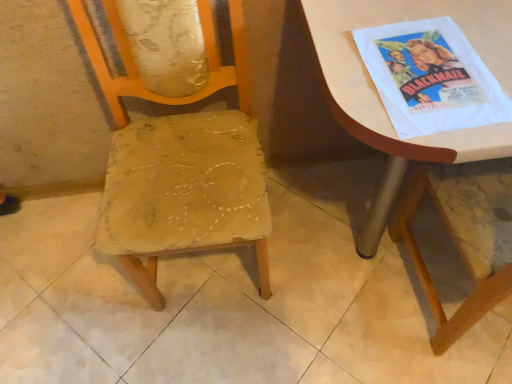
Question: Considering the relative sizes of white paper poster at upper right and worn fabric chair at center in the image provided, is white paper poster at upper right bigger than worn fabric chair at center?

Choices:
 (A) yes
 (B) no

Answer: (B)

Question: Is white paper poster at upper right to the right of worn fabric chair at center from the viewer's perspective?

Choices:
 (A) no
 (B) yes

Answer: (B)

Question: Is worn fabric chair at center a part of white paper poster at upper right?

Choices:
 (A) yes
 (B) no

Answer: (B)

Question: Considering the relative sizes of white paper poster at upper right and worn fabric chair at center in the image provided, is white paper poster at upper right wider than worn fabric chair at center?

Choices:
 (A) yes
 (B) no

Answer: (B)

Question: Is the position of white paper poster at upper right less distant than that of worn fabric chair at center?

Choices:
 (A) yes
 (B) no

Answer: (B)

Question: Is white paper poster at upper right shorter than worn fabric chair at center?

Choices:
 (A) no
 (B) yes

Answer: (B)

Question: Considering the relative sizes of white glossy table at upper right and worn fabric chair at center in the image provided, is white glossy table at upper right bigger than worn fabric chair at center?

Choices:
 (A) no
 (B) yes

Answer: (B)

Question: Is white glossy table at upper right positioned beyond the bounds of worn fabric chair at center?

Choices:
 (A) yes
 (B) no

Answer: (A)

Question: From a real-world perspective, is white glossy table at upper right below worn fabric chair at center?

Choices:
 (A) yes
 (B) no

Answer: (A)

Question: Can you confirm if white glossy table at upper right is smaller than worn fabric chair at center?

Choices:
 (A) no
 (B) yes

Answer: (A)

Question: Can you confirm if white glossy table at upper right is shorter than worn fabric chair at center?

Choices:
 (A) no
 (B) yes

Answer: (B)

Question: Are white glossy table at upper right and worn fabric chair at center making contact?

Choices:
 (A) no
 (B) yes

Answer: (A)

Question: Is worn fabric chair at center completely or partially outside of white glossy table at upper right?

Choices:
 (A) yes
 (B) no

Answer: (A)